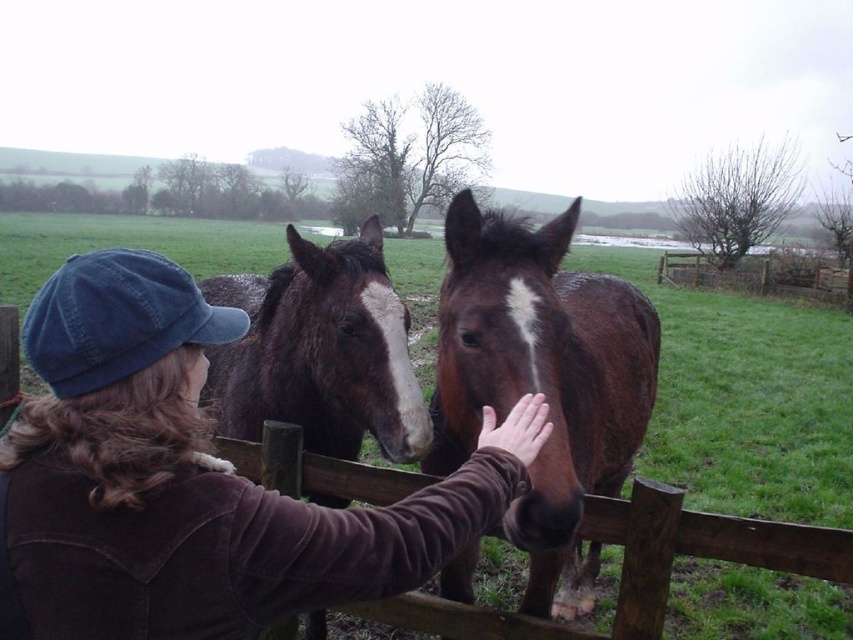
Is brown glossy horse at center above brown leather hand at center?

Indeed, brown glossy horse at center is positioned over brown leather hand at center.

Does brown glossy horse at center appear on the left side of brown leather hand at center?

Yes, brown glossy horse at center is to the left of brown leather hand at center.

What do you see at coordinates (318, 353) in the screenshot? I see `brown glossy horse at center` at bounding box center [318, 353].

Identify the location of brown glossy horse at center. The image size is (853, 640). (318, 353).

Does brown glossy horse at center have a greater width compared to wooden fence at right?

Yes, brown glossy horse at center is wider than wooden fence at right.

Does brown glossy horse at center appear on the left side of wooden fence at right?

Indeed, brown glossy horse at center is positioned on the left side of wooden fence at right.

Does point (254, 403) come behind point (810, 294)?

No, it is in front of (810, 294).

Find the location of `brown glossy horse at center`. brown glossy horse at center is located at coordinates coord(318,353).

Which of these two, brown corduroy jacket at center or brown shiny horse at center, stands shorter?

Standing shorter between the two is brown corduroy jacket at center.

Can you confirm if brown corduroy jacket at center is thinner than brown shiny horse at center?

Yes, brown corduroy jacket at center is thinner than brown shiny horse at center.

The width and height of the screenshot is (853, 640). Identify the location of brown corduroy jacket at center. (184, 481).